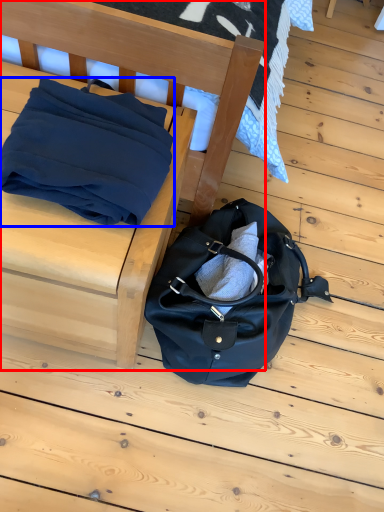
Question: Which point is further to the camera, furniture (highlighted by a red box) or blanket (highlighted by a blue box)?

Choices:
 (A) furniture
 (B) blanket

Answer: (B)